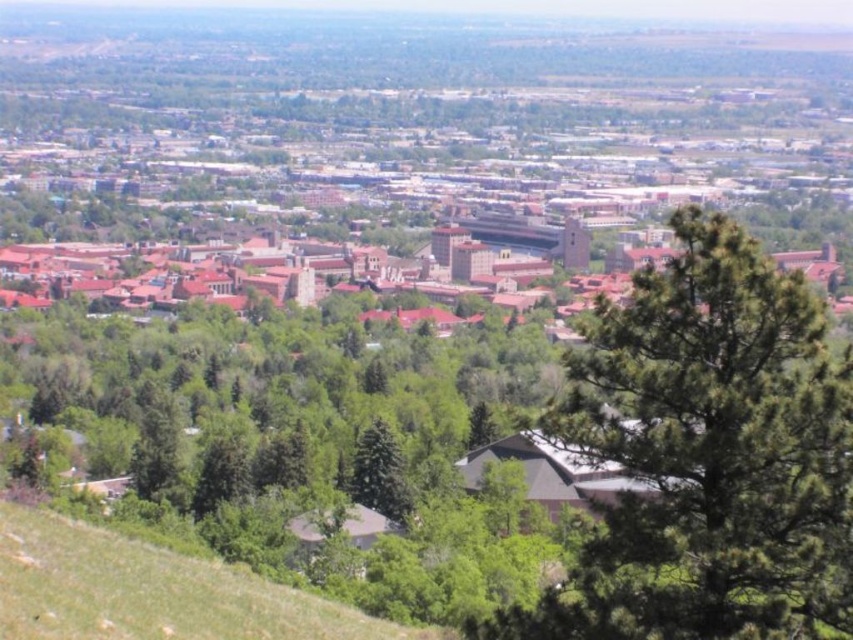
Does green leafy tree at center appear on the right side of green grassy hillside at lower left?

Yes, green leafy tree at center is to the right of green grassy hillside at lower left.

Which is in front, point (685, 488) or point (99, 636)?

Positioned in front is point (99, 636).

This screenshot has height=640, width=853. In order to click on green leafy tree at center in this screenshot , I will do `click(709, 454)`.

Where is `green leafy tree at center`? Image resolution: width=853 pixels, height=640 pixels. green leafy tree at center is located at coordinates (709, 454).

Is green leafy tree at center smaller than green matte tree at center?

Actually, green leafy tree at center might be larger than green matte tree at center.

Who is more forward, (840, 477) or (361, 460)?

Positioned in front is point (840, 477).

Is point (724, 240) positioned behind point (403, 518)?

That is False.

At what (x,y) coordinates should I click in order to perform the action: click on green leafy tree at center. Please return your answer as a coordinate pair (x, y). The image size is (853, 640). Looking at the image, I should click on (709, 454).

Does green grassy hillside at lower left have a larger size compared to green matte tree at center?

Indeed, green grassy hillside at lower left has a larger size compared to green matte tree at center.

Does point (68, 522) come behind point (379, 436)?

Yes, it is behind point (379, 436).

Between point (279, 596) and point (358, 486), which one is positioned in front?

Point (279, 596) is more forward.

I want to click on green grassy hillside at lower left, so click(x=152, y=592).